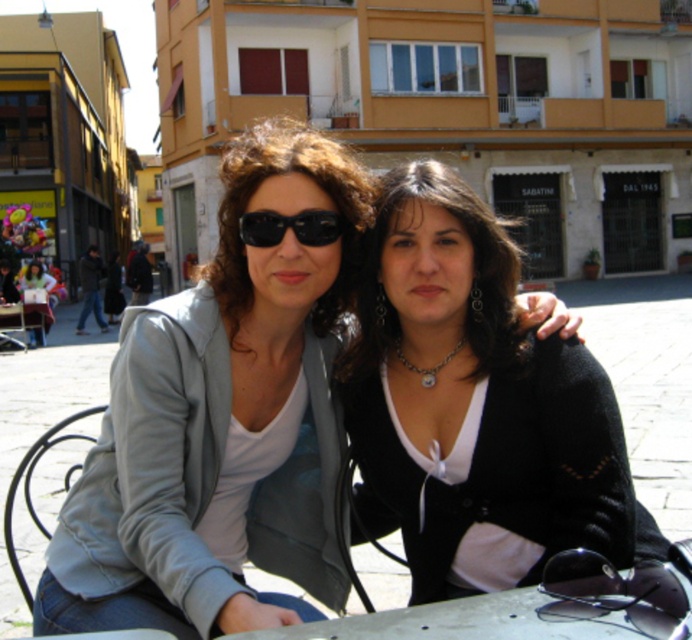
Question: Which point appears closest to the camera in this image?

Choices:
 (A) (46, 324)
 (B) (673, 552)
 (C) (260, 227)
 (D) (430, 372)

Answer: (B)

Question: Can you confirm if matte black sunglasses at center is thinner than black plastic sunglasses at upper center?

Choices:
 (A) yes
 (B) no

Answer: (B)

Question: Is black matte sweater at center closer to the viewer compared to matte black sunglasses at center?

Choices:
 (A) yes
 (B) no

Answer: (A)

Question: Which point is farther from the camera taking this photo?

Choices:
 (A) (37, 332)
 (B) (480, 284)
 (C) (100, 531)

Answer: (A)

Question: Among these points, which one is farthest from the camera?

Choices:
 (A) (579, 518)
 (B) (273, 241)
 (C) (237, 346)
 (D) (246, 144)

Answer: (D)

Question: Is the position of matte black sunglasses at center more distant than that of metallic silver table at lower left?

Choices:
 (A) yes
 (B) no

Answer: (B)